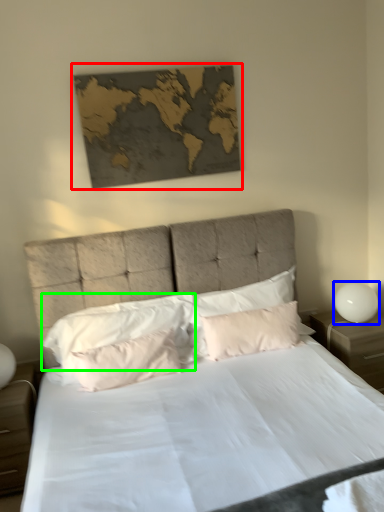
Question: Estimate the real-world distances between objects in this image. Which object is closer to picture frame (highlighted by a red box), bedside lamp (highlighted by a blue box) or pillow (highlighted by a green box)?

Choices:
 (A) bedside lamp
 (B) pillow

Answer: (B)